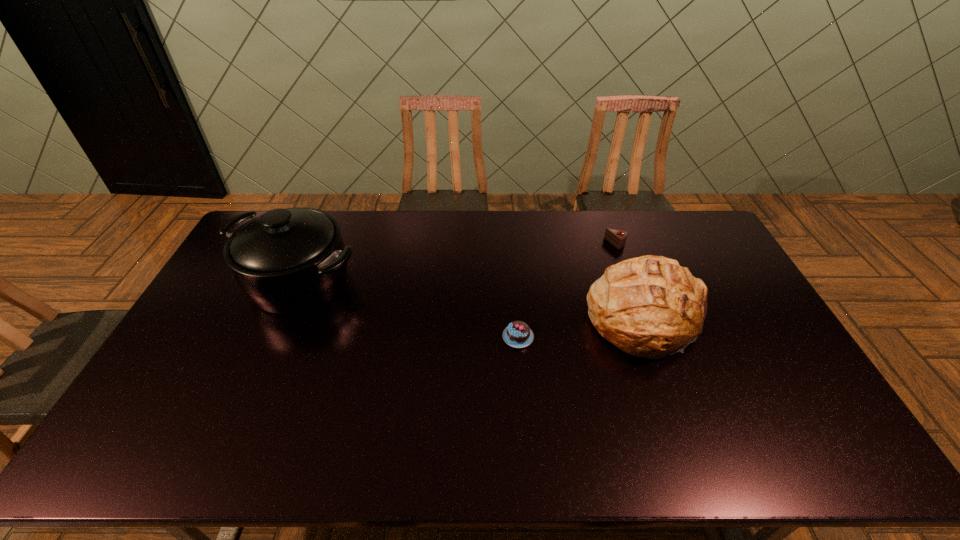
Identify the location of vacant space that's between the bread and the leftmost object. The height and width of the screenshot is (540, 960). (473, 300).

Locate an element on the screen. free space between the right chocolate cake and the leftmost object is located at coordinates (458, 262).

You are a GUI agent. You are given a task and a screenshot of the screen. Output one action in this format:
    pyautogui.click(x=<x>, y=<y>)
    Task: Click on the free area in between the leftmost object and the third shortest object
    The image size is (960, 540).
    Given the screenshot: What is the action you would take?
    pyautogui.click(x=473, y=300)

Where is `free space between the left chocolate cake and the right chocolate cake`? The image size is (960, 540). free space between the left chocolate cake and the right chocolate cake is located at coordinates (567, 290).

Identify the location of vacant area that lies between the right chocolate cake and the left chocolate cake. The height and width of the screenshot is (540, 960). (567, 290).

Find the location of `vacant space that's between the nearer chocolate cake and the tallest object`. vacant space that's between the nearer chocolate cake and the tallest object is located at coordinates (409, 309).

This screenshot has width=960, height=540. What are the coordinates of `free space between the right chocolate cake and the left chocolate cake` in the screenshot? It's located at (567, 290).

The height and width of the screenshot is (540, 960). What are the coordinates of `vacant region between the second tallest object and the tallest object` in the screenshot? It's located at (473, 300).

I want to click on empty space that is in between the tallest object and the right chocolate cake, so (458, 262).

The image size is (960, 540). I want to click on object that stands as the closest to the saucepan, so click(518, 334).